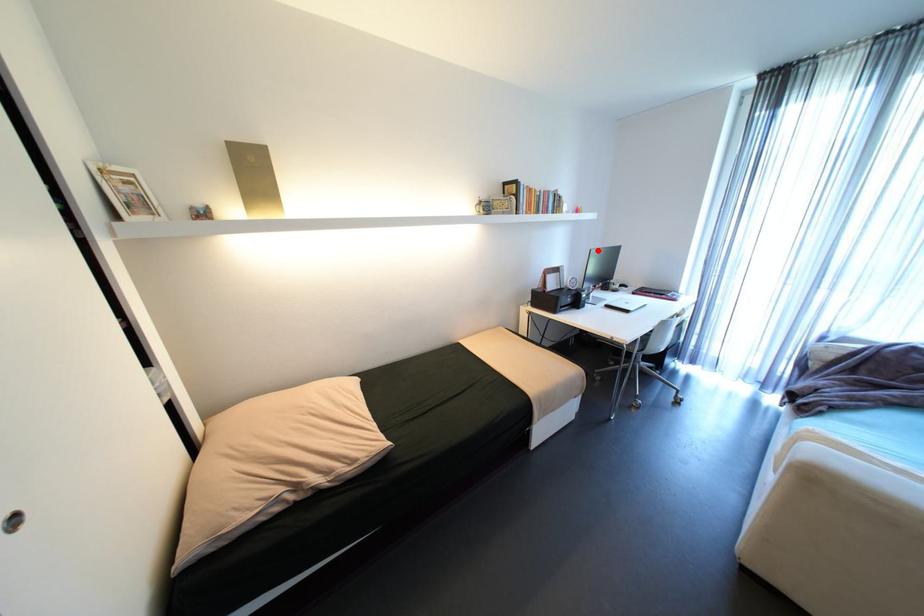
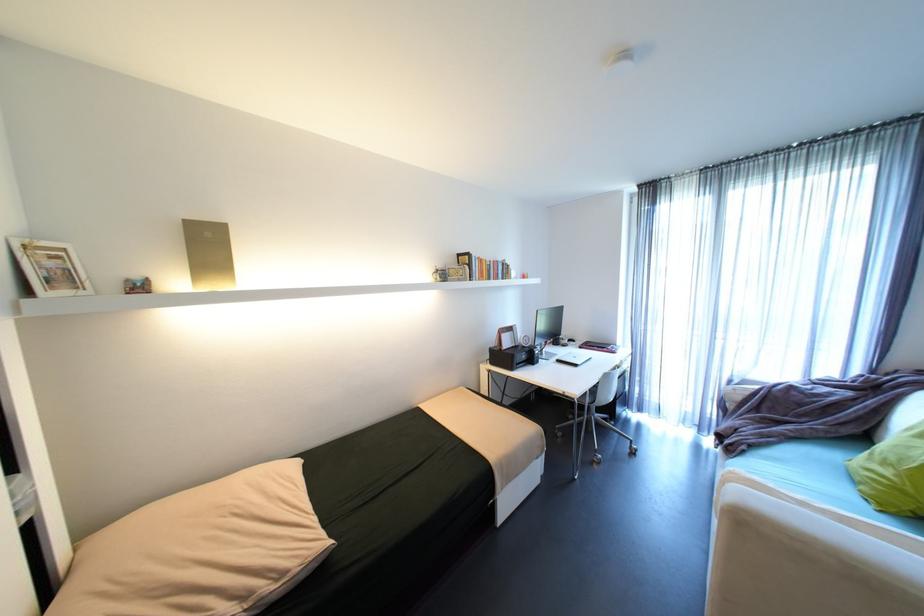
Question: I am providing you with two images of the same scene from different viewpoints. In image1, a red point is highlighted. Considering the same 3D point in image2, which of the following is correct?

Choices:
 (A) It is closer
 (B) It is farther

Answer: (B)